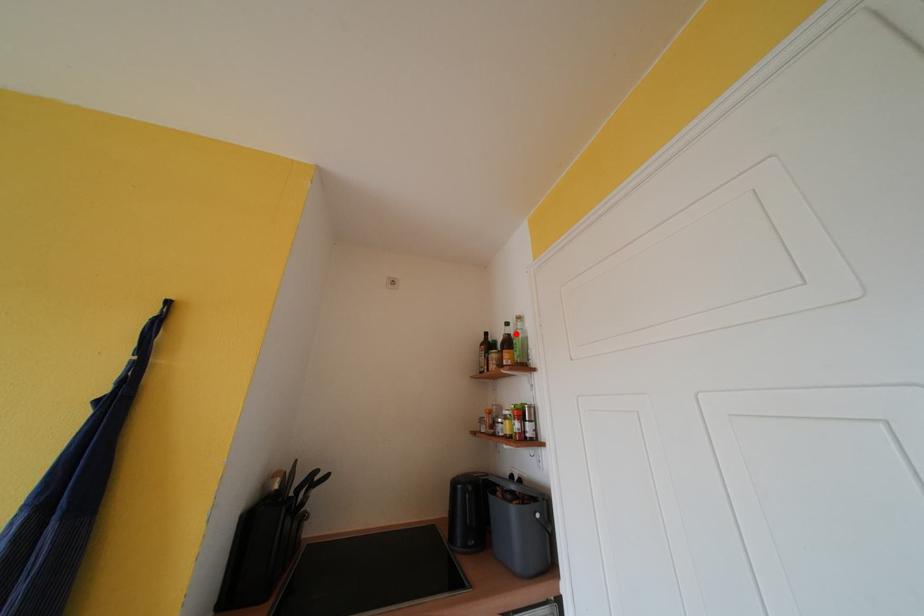
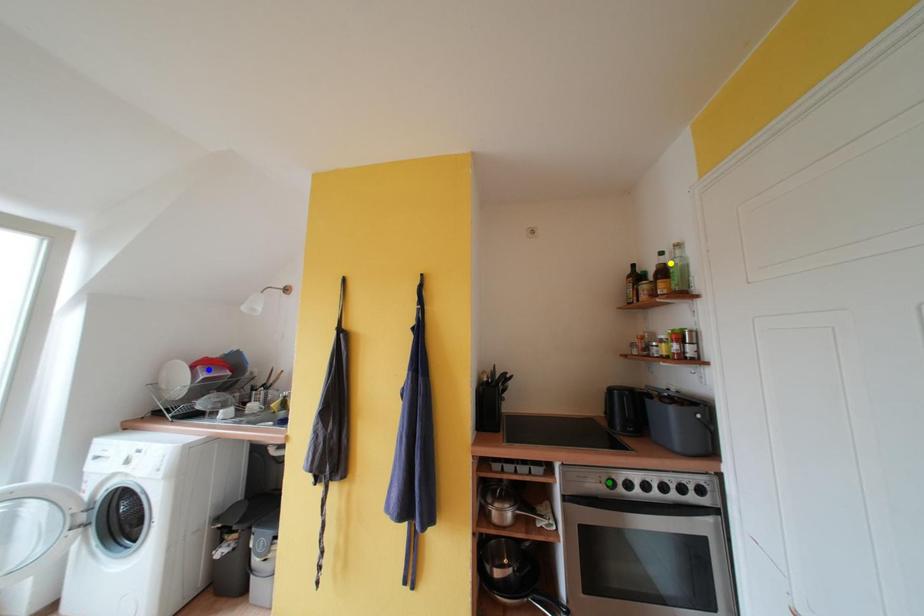
Question: I am providing you with two images of the same scene from different viewpoints. A red point is marked on the first image. You are given multiple points on the second image. Can you choose the point in image 2 that corresponds to the point in image 1?

Choices:
 (A) yellow point
 (B) green point
 (C) blue point

Answer: (A)